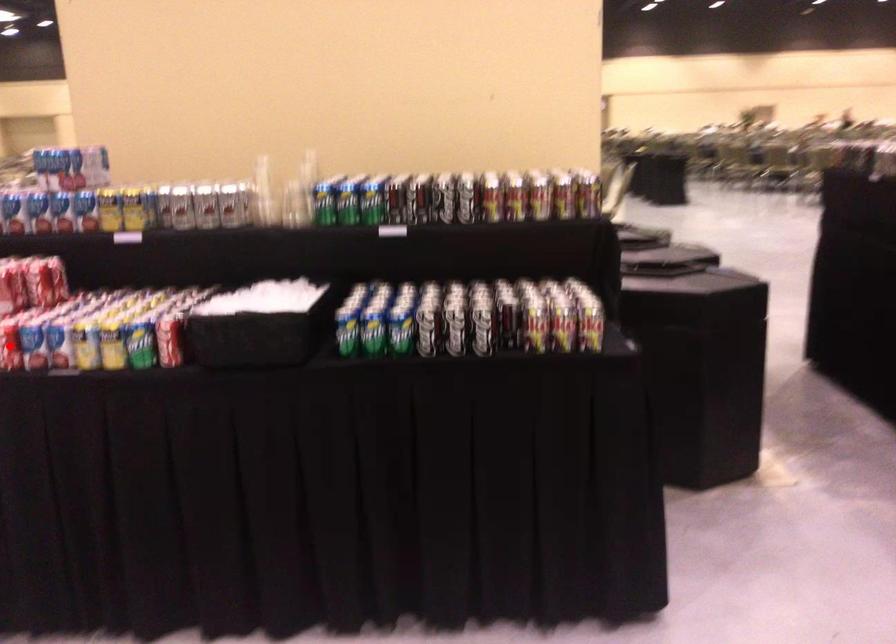
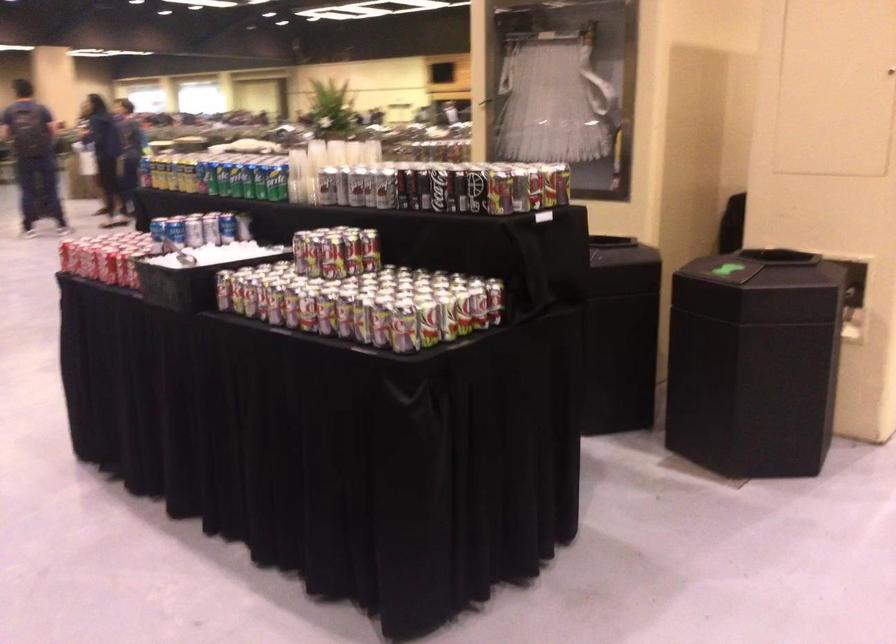
Question: I am providing you with two images of the same scene from different viewpoints. A red point is marked on the first image. Is the red point's position out of view in image 2?

Choices:
 (A) Yes
 (B) No

Answer: (A)